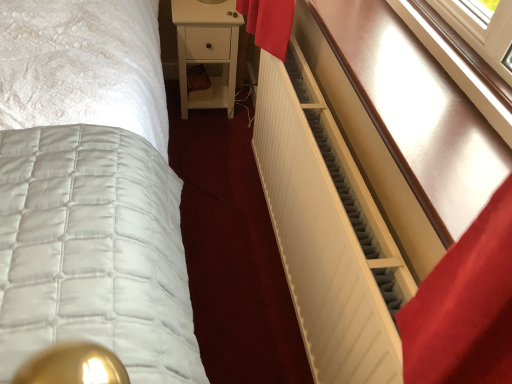
Question: Is matte white radiator at right positioned beyond the bounds of white matte nightstand at center?

Choices:
 (A) yes
 (B) no

Answer: (A)

Question: From the image's perspective, is matte white radiator at right under white matte nightstand at center?

Choices:
 (A) no
 (B) yes

Answer: (B)

Question: Is the depth of matte white radiator at right greater than that of white matte nightstand at center?

Choices:
 (A) no
 (B) yes

Answer: (A)

Question: Does matte white radiator at right have a lesser width compared to white matte nightstand at center?

Choices:
 (A) yes
 (B) no

Answer: (A)

Question: Are matte white radiator at right and white matte nightstand at center far apart?

Choices:
 (A) yes
 (B) no

Answer: (A)

Question: Considering the relative positions of matte white radiator at right and white quilted bed at center in the image provided, is matte white radiator at right to the left or to the right of white quilted bed at center?

Choices:
 (A) right
 (B) left

Answer: (A)

Question: Choose the correct answer: Is matte white radiator at right inside white quilted bed at center or outside it?

Choices:
 (A) inside
 (B) outside

Answer: (B)

Question: Is point (381, 109) closer or farther from the camera than point (135, 317)?

Choices:
 (A) closer
 (B) farther

Answer: (A)

Question: From a real-world perspective, relative to white quilted bed at center, is matte white radiator at right vertically above or below?

Choices:
 (A) above
 (B) below

Answer: (A)

Question: Is white matte nightstand at center inside the boundaries of white quilted bed at center, or outside?

Choices:
 (A) inside
 (B) outside

Answer: (B)

Question: In terms of height, does white matte nightstand at center look taller or shorter compared to white quilted bed at center?

Choices:
 (A) tall
 (B) short

Answer: (A)

Question: Is white matte nightstand at center bigger or smaller than white quilted bed at center?

Choices:
 (A) small
 (B) big

Answer: (A)

Question: Relative to white quilted bed at center, is white matte nightstand at center in front or behind?

Choices:
 (A) front
 (B) behind

Answer: (B)

Question: Is point (1, 377) positioned closer to the camera than point (311, 99)?

Choices:
 (A) closer
 (B) farther

Answer: (A)

Question: From a real-world perspective, is white quilted bed at center positioned above or below white matte radiator at right?

Choices:
 (A) below
 (B) above

Answer: (A)